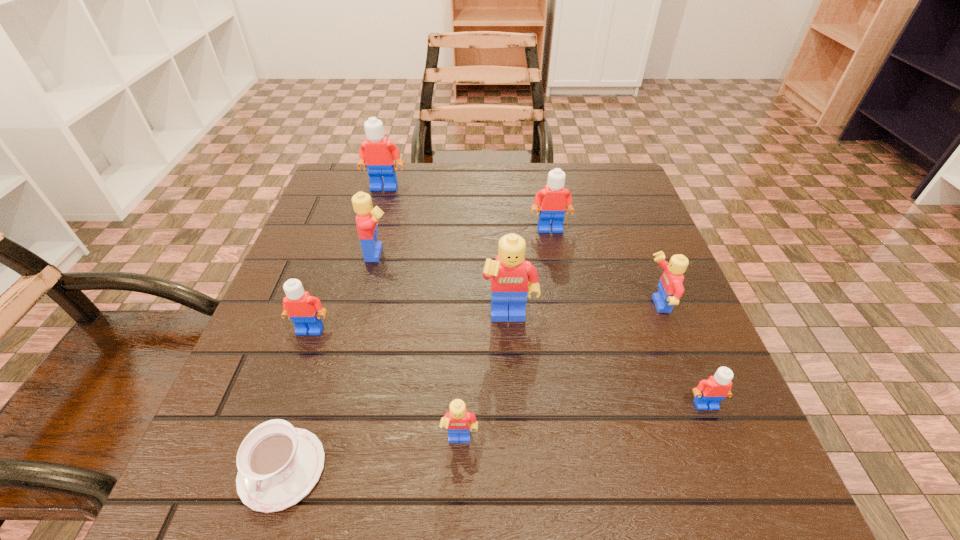
Where is `the smallest yellow Lego`? the smallest yellow Lego is located at coordinates 459,422.

Find the location of a particular element. This screenshot has height=540, width=960. the nearest yellow Lego is located at coordinates (459, 422).

Find the location of `the nearest white Lego`. the nearest white Lego is located at coordinates (709, 393).

This screenshot has width=960, height=540. I want to click on the third nearest object, so click(709, 393).

Locate an element on the screen. teacup is located at coordinates (278, 465).

Locate an element on the screen. The height and width of the screenshot is (540, 960). free space located 0.240m on the face of the sixth object from left to right is located at coordinates (520, 475).

Where is `vacant space located 0.290m on the face of the farthest object`? The width and height of the screenshot is (960, 540). vacant space located 0.290m on the face of the farthest object is located at coordinates click(x=360, y=271).

The height and width of the screenshot is (540, 960). I want to click on vacant space located on the face of the third farthest object, so click(x=522, y=253).

The image size is (960, 540). What are the coordinates of `vacant space positioned 0.110m on the face of the seventh object from left to right` in the screenshot? It's located at (557, 267).

Where is `free space located on the face of the third biggest yellow Lego`? This screenshot has height=540, width=960. free space located on the face of the third biggest yellow Lego is located at coordinates (579, 306).